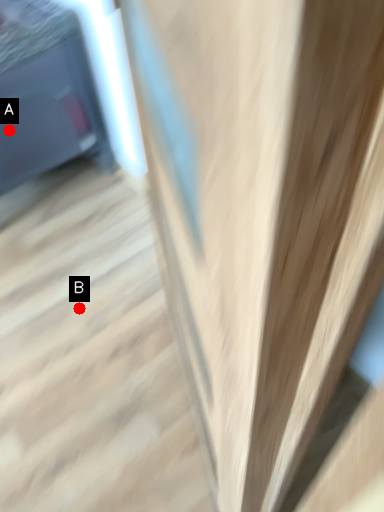
Question: Two points are circled on the image, labeled by A and B beside each circle. Which point is farther from the camera taking this photo?

Choices:
 (A) A is further
 (B) B is further

Answer: (A)